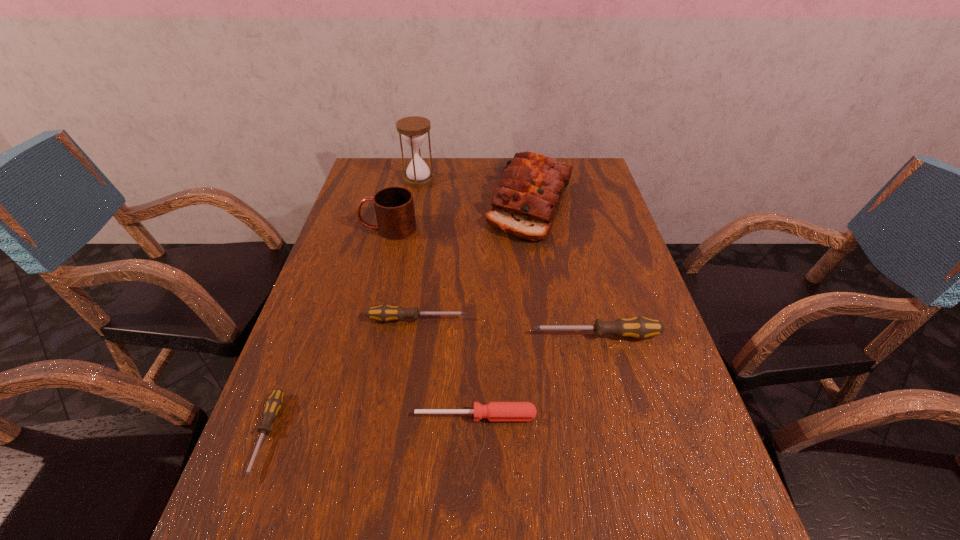
Select which screwdriver is the closest to the farthest screwdriver. Please provide its 2D coordinates. Your answer should be formatted as a tuple, i.e. [(x, y)], where the tuple contains the x and y coordinates of a point satisfying the conditions above.

[(638, 327)]

Select which gray screwdriver is the second closest to the red screwdriver. Please provide its 2D coordinates. Your answer should be formatted as a tuple, i.e. [(x, y)], where the tuple contains the x and y coordinates of a point satisfying the conditions above.

[(384, 313)]

Identify which gray screwdriver is located as the second nearest to the hourglass. Please provide its 2D coordinates. Your answer should be formatted as a tuple, i.e. [(x, y)], where the tuple contains the x and y coordinates of a point satisfying the conditions above.

[(638, 327)]

Locate an element on the screen. free space that satisfies the following two spatial constraints: 1. on the side of the red screwdriver with the handle; 2. on the right side of the mug is located at coordinates (341, 416).

Find the location of a particular element. free space that satisfies the following two spatial constraints: 1. on the front side of the red screwdriver; 2. on the left side of the white hourglass is located at coordinates (373, 416).

At what (x,y) coordinates should I click in order to perform the action: click on free space that satisfies the following two spatial constraints: 1. on the side of the red screwdriver with the handle; 2. on the right side of the mug. Please return your answer as a coordinate pair (x, y). Looking at the image, I should click on (341, 416).

Identify the location of free spot that satisfies the following two spatial constraints: 1. at the tip of the fifth farthest object; 2. at the tip of the smallest gray screwdriver. (620, 435).

At what (x,y) coordinates should I click in order to perform the action: click on vacant region that satisfies the following two spatial constraints: 1. on the side of the rust mug with the handle; 2. on the left side of the red screwdriver. Please return your answer as a coordinate pair (x, y). Looking at the image, I should click on (341, 416).